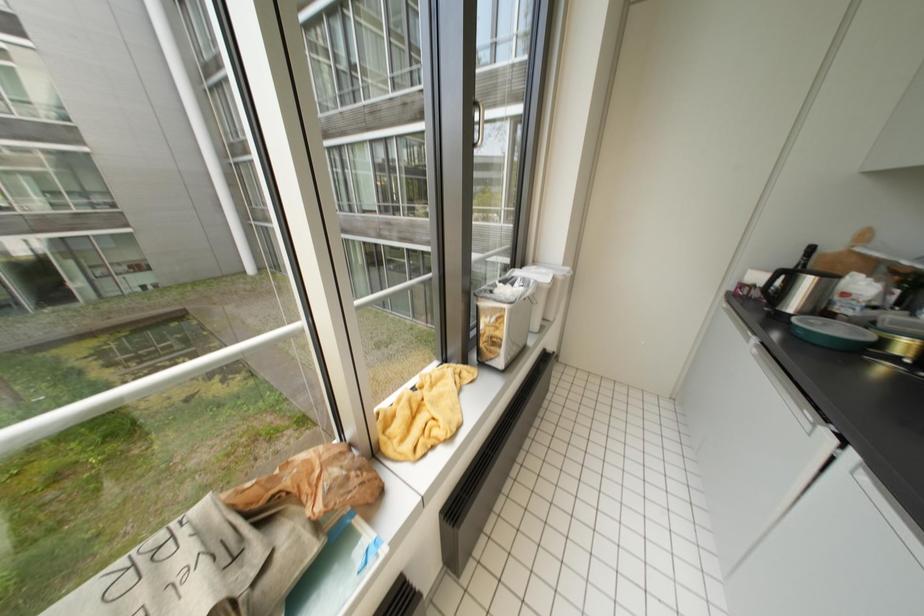
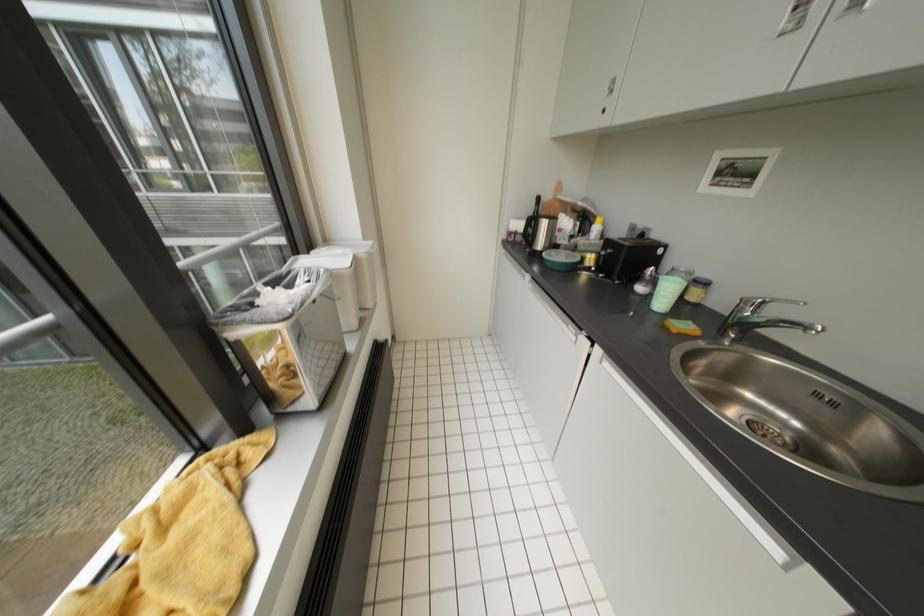
Question: The camera is either moving clockwise (left) or counter-clockwise (right) around the object. The first image is from the beginning of the video and the second image is from the end. Is the camera moving left or right when shooting the video?

Choices:
 (A) Left
 (B) Right

Answer: (A)